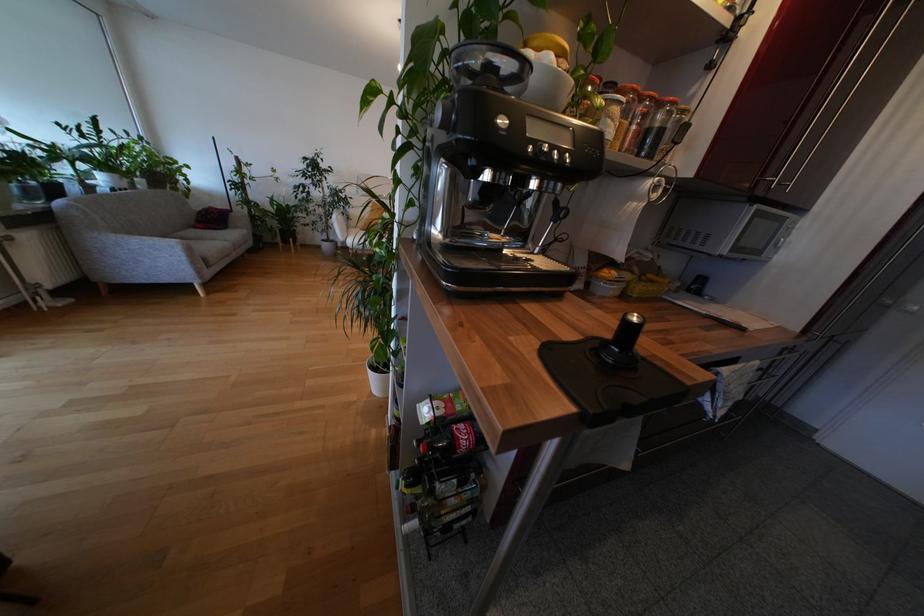
This screenshot has height=616, width=924. I want to click on white plant pot, so click(378, 377).